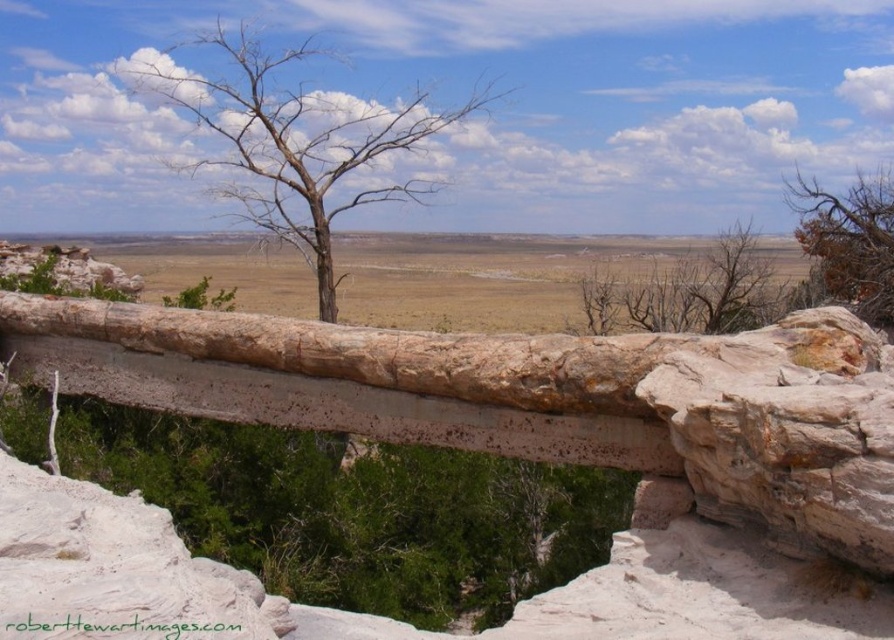
Is point (158, 67) positioned after point (858, 227)?

Yes, point (158, 67) is behind point (858, 227).

Who is higher up, bare wood tree at center or brown/dry wood tree at upper right?

brown/dry wood tree at upper right

The width and height of the screenshot is (894, 640). What are the coordinates of `bare wood tree at center` in the screenshot? It's located at (298, 145).

Does brown bark tree at center appear over brown/dry wood tree at upper right?

No.

Who is taller, brown bark tree at center or brown/dry wood tree at upper right?

brown/dry wood tree at upper right

Locate an element on the screen. This screenshot has width=894, height=640. brown bark tree at center is located at coordinates (689, 292).

Which of these two, bare wood tree at center or brown bark tree at center, stands taller?

bare wood tree at center

Does bare wood tree at center come in front of brown bark tree at center?

Yes, bare wood tree at center is in front of brown bark tree at center.

Which is in front, point (326, 218) or point (713, 266)?

Point (326, 218) is in front.

Image resolution: width=894 pixels, height=640 pixels. Identify the location of bare wood tree at center. (298, 145).